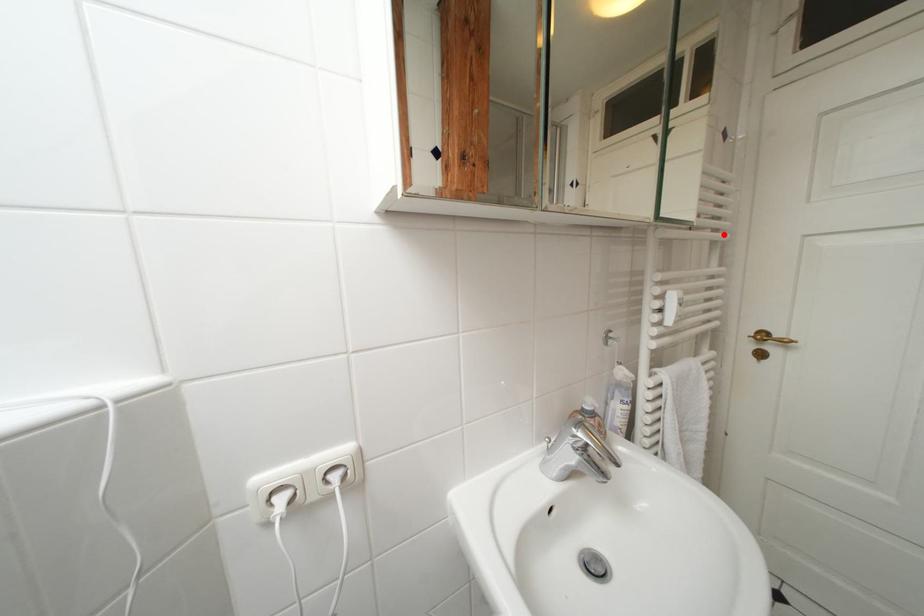
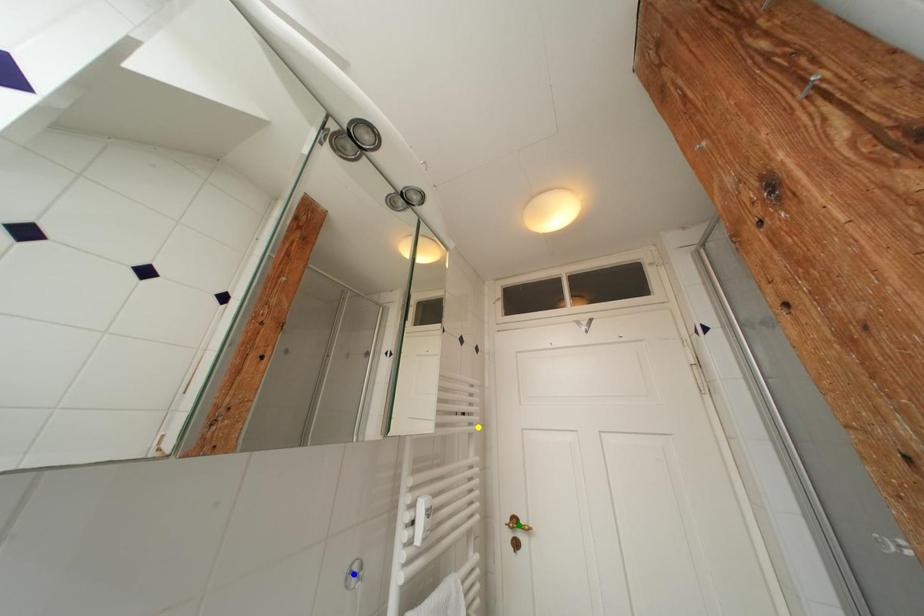
Question: I am providing you with two images of the same scene from different viewpoints. A red point is marked on the first image. You are given multiple points on the second image. Which spot in image 2 lines up with the point in image 1?

Choices:
 (A) yellow point
 (B) blue point
 (C) green point

Answer: (A)